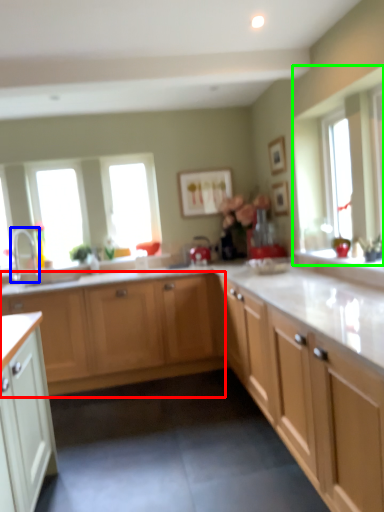
Question: Based on their relative distances, which object is farther from cabinetry (highlighted by a red box)? Choose from tap (highlighted by a blue box) and window (highlighted by a green box).

Choices:
 (A) tap
 (B) window

Answer: (B)